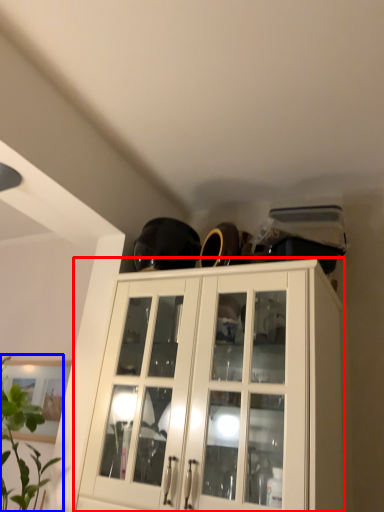
Question: Which object is further to the camera taking this photo, cabinetry (highlighted by a red box) or houseplant (highlighted by a blue box)?

Choices:
 (A) cabinetry
 (B) houseplant

Answer: (A)